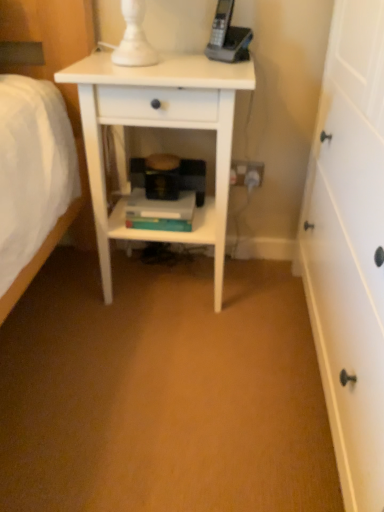
Identify the location of free region under white matte nightstand at center (from a real-world perspective). (162, 282).